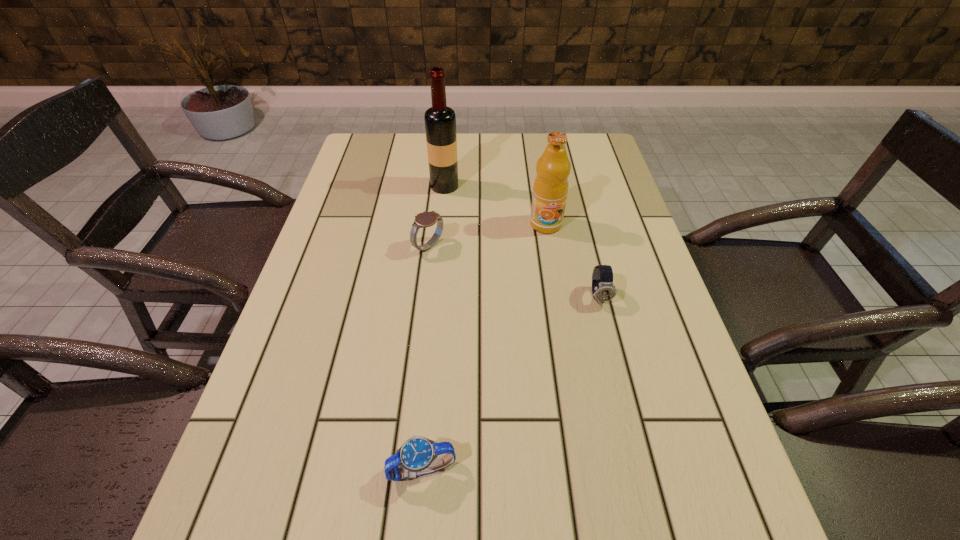
What are the coordinates of `vacant space in between the tallest object and the nearest object` in the screenshot? It's located at (433, 328).

The image size is (960, 540). What are the coordinates of `vacant space in between the second object from right to left and the fourth farthest object` in the screenshot? It's located at (572, 260).

The width and height of the screenshot is (960, 540). I want to click on free space between the farthest watch and the nearest object, so click(x=425, y=358).

Where is `empty location between the tallest object and the rightmost watch`? This screenshot has width=960, height=540. empty location between the tallest object and the rightmost watch is located at coordinates (522, 241).

Where is `vacant space that is in between the fourth shortest object and the shortest watch`? This screenshot has width=960, height=540. vacant space that is in between the fourth shortest object and the shortest watch is located at coordinates (x=484, y=347).

Identify the location of free point between the second nearest object and the second tallest object. (572, 260).

Find the location of `free space that is in between the wine bottle and the second object from right to left`. free space that is in between the wine bottle and the second object from right to left is located at coordinates (495, 205).

This screenshot has height=540, width=960. In order to click on free space between the rightmost object and the third farthest object in this screenshot , I will do `click(514, 271)`.

At what (x,y) coordinates should I click in order to perform the action: click on vacant region between the second nearest object and the third farthest object. Please return your answer as a coordinate pair (x, y). This screenshot has width=960, height=540. Looking at the image, I should click on (514, 271).

I want to click on object that stands as the fourth closest to the wine bottle, so click(417, 456).